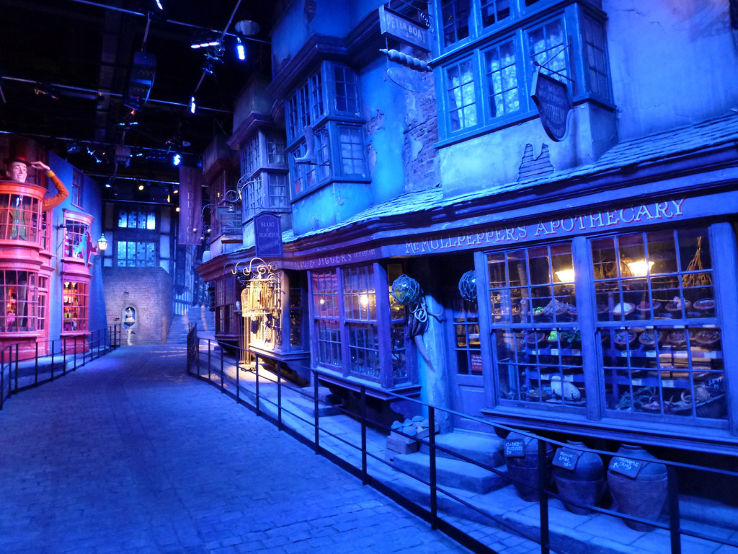
Image resolution: width=738 pixels, height=554 pixels. I want to click on doors, so click(460, 364), click(41, 316).